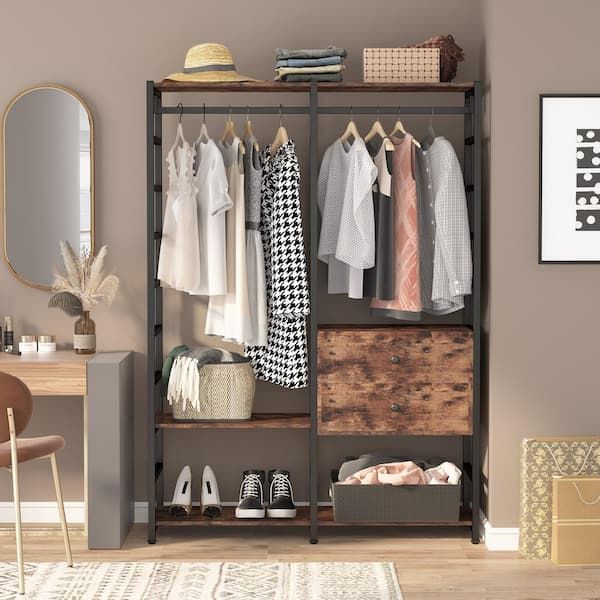
The width and height of the screenshot is (600, 600). I want to click on clothes hangers, so click(181, 131), click(202, 131), click(228, 131), click(247, 131), click(280, 132), click(351, 126), click(376, 126), click(398, 126), click(428, 126).